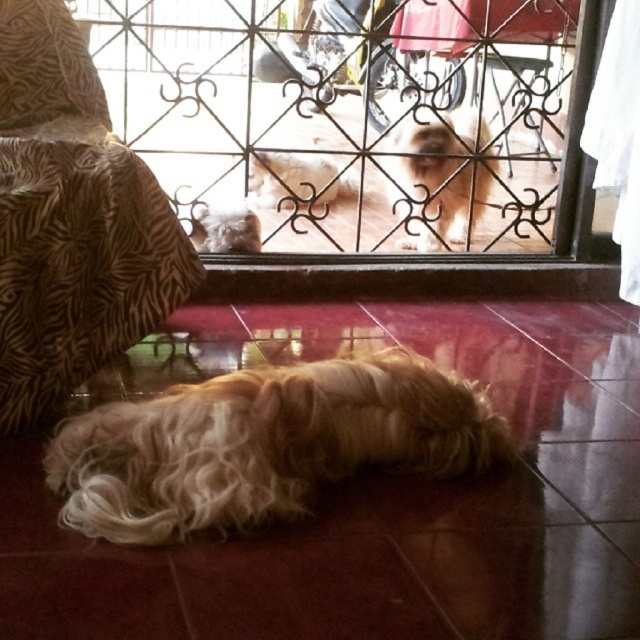
You are a delivery person trying to bring a large package through the clear glass door at center. The package is as wide as the fluffy golden dog at lower center. Will the package fit through the door?

The clear glass door at center is wider than the fluffy golden dog at lower center, so the package, which is as wide as the dog, will fit through the door.

You are a guest entering the room and see the clear glass door at center and the fuzzy beige dog at center. Which object is bigger?

The clear glass door at center is larger in size than the fuzzy beige dog at center.